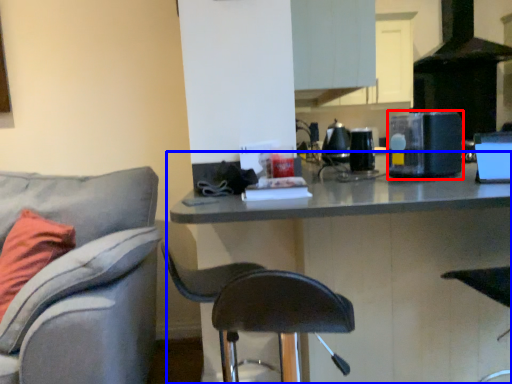
Question: Among these objects, which one is farthest to the camera, appliance (highlighted by a red box) or table (highlighted by a blue box)?

Choices:
 (A) appliance
 (B) table

Answer: (A)